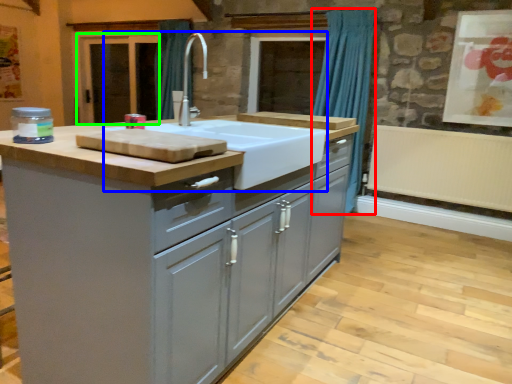
Question: Estimate the real-world distances between objects in this image. Which object is farther from curtain (highlighted by a red box), sink (highlighted by a blue box) or screen door (highlighted by a green box)?

Choices:
 (A) sink
 (B) screen door

Answer: (B)